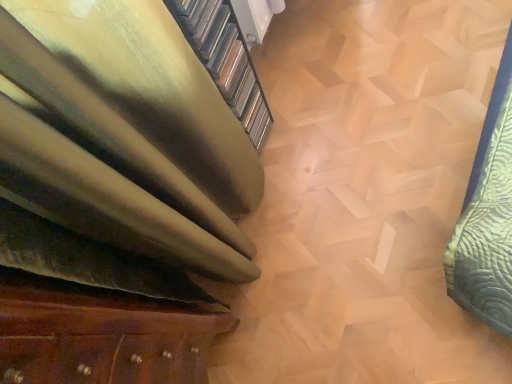
Question: Does gold textured stairwell at upper left come in front of wooden drawer at lower left?

Choices:
 (A) yes
 (B) no

Answer: (B)

Question: From the image's perspective, is gold textured stairwell at upper left below wooden drawer at lower left?

Choices:
 (A) yes
 (B) no

Answer: (B)

Question: Is wooden drawer at lower left a part of gold textured stairwell at upper left?

Choices:
 (A) no
 (B) yes

Answer: (A)

Question: From a real-world perspective, does gold textured stairwell at upper left stand above wooden drawer at lower left?

Choices:
 (A) yes
 (B) no

Answer: (B)

Question: Does gold textured stairwell at upper left come behind wooden drawer at lower left?

Choices:
 (A) no
 (B) yes

Answer: (B)

Question: Is gold textured stairwell at upper left facing away from wooden drawer at lower left?

Choices:
 (A) no
 (B) yes

Answer: (A)

Question: Is wooden drawer at lower left thinner than gold textured stairwell at upper left?

Choices:
 (A) no
 (B) yes

Answer: (A)

Question: Is gold textured stairwell at upper left inside wooden drawer at lower left?

Choices:
 (A) yes
 (B) no

Answer: (B)

Question: From the image's perspective, is wooden drawer at lower left above gold textured stairwell at upper left?

Choices:
 (A) no
 (B) yes

Answer: (A)

Question: Does wooden drawer at lower left appear on the right side of gold textured stairwell at upper left?

Choices:
 (A) no
 (B) yes

Answer: (A)

Question: Does wooden drawer at lower left lie in front of gold textured stairwell at upper left?

Choices:
 (A) yes
 (B) no

Answer: (A)

Question: Considering the relative positions of wooden drawer at lower left and gold textured stairwell at upper left in the image provided, is wooden drawer at lower left to the left of gold textured stairwell at upper left from the viewer's perspective?

Choices:
 (A) no
 (B) yes

Answer: (B)

Question: Considering the positions of gold textured stairwell at upper left and wooden drawer at lower left in the image, is gold textured stairwell at upper left taller or shorter than wooden drawer at lower left?

Choices:
 (A) tall
 (B) short

Answer: (B)